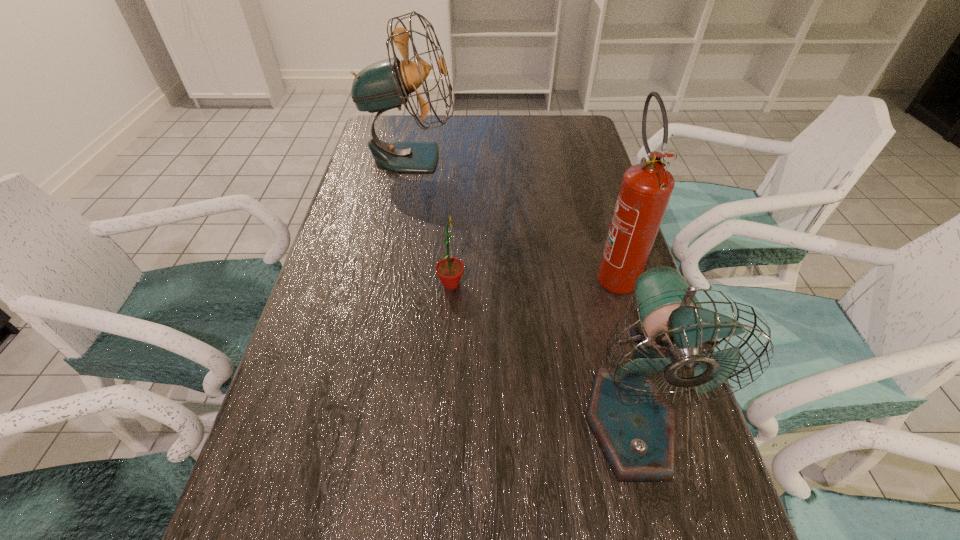
Identify which object is the closest to the right fan. Please provide its 2D coordinates. Your answer should be formatted as a tuple, i.e. [(x, y)], where the tuple contains the x and y coordinates of a point satisfying the conditions above.

[(646, 188)]

Image resolution: width=960 pixels, height=540 pixels. Identify the location of vacant space that satisfies the following two spatial constraints: 1. from the nozzle of the fire extinguisher; 2. on the face of the shortest object. (618, 284).

In order to click on vacant space that satisfies the following two spatial constraints: 1. from the nozzle of the fire extinguisher; 2. on the face of the sunflower in this screenshot , I will do `click(618, 284)`.

Find the location of a particular element. free space that satisfies the following two spatial constraints: 1. from the nozzle of the fire extinguisher; 2. on the face of the sunflower is located at coordinates tap(618, 284).